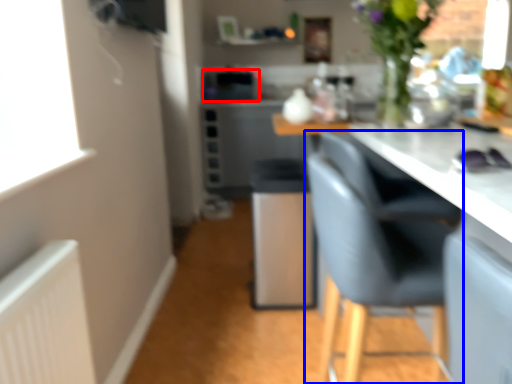
Question: Among these objects, which one is farthest to the camera, appliance (highlighted by a red box) or chair (highlighted by a blue box)?

Choices:
 (A) appliance
 (B) chair

Answer: (A)